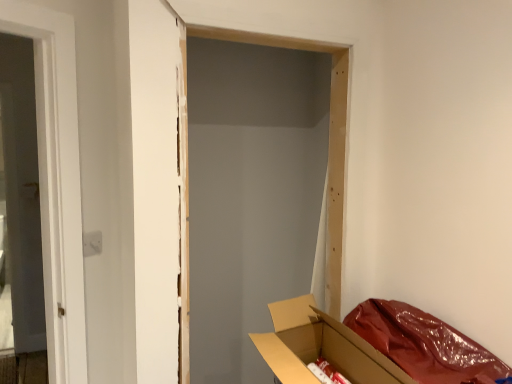
Question: In the image, is cardboard box at lower right on the left side or the right side of white fabric curtain at right?

Choices:
 (A) right
 (B) left

Answer: (B)

Question: In terms of width, does cardboard box at lower right look wider or thinner when compared to white fabric curtain at right?

Choices:
 (A) thin
 (B) wide

Answer: (B)

Question: From the image's perspective, is cardboard box at lower right located above or below white fabric curtain at right?

Choices:
 (A) above
 (B) below

Answer: (B)

Question: From the image's perspective, is white fabric curtain at right above or below cardboard box at lower right?

Choices:
 (A) below
 (B) above

Answer: (B)

Question: From their relative heights in the image, would you say white fabric curtain at right is taller or shorter than cardboard box at lower right?

Choices:
 (A) tall
 (B) short

Answer: (A)

Question: Would you say white fabric curtain at right is inside or outside cardboard box at lower right?

Choices:
 (A) inside
 (B) outside

Answer: (B)

Question: Considering the relative positions of white fabric curtain at right and cardboard box at lower right in the image provided, is white fabric curtain at right to the left or to the right of cardboard box at lower right?

Choices:
 (A) left
 (B) right

Answer: (B)